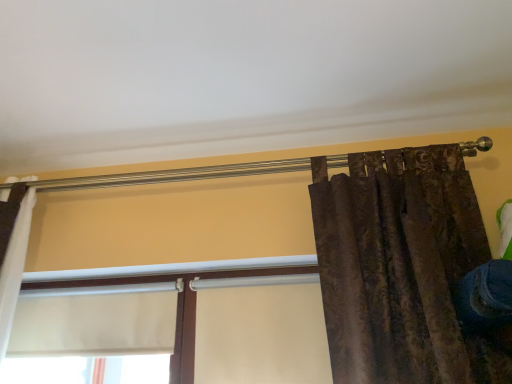
Question: Considering the relative sizes of white matte window at center, arranged as the first window when viewed from the left, and blue denim jeans at lower right in the image provided, is white matte window at center, arranged as the first window when viewed from the left, wider than blue denim jeans at lower right?

Choices:
 (A) no
 (B) yes

Answer: (A)

Question: Is white matte window at center, the 2th window positioned from the right, at the left side of blue denim jeans at lower right?

Choices:
 (A) no
 (B) yes

Answer: (B)

Question: Is white matte window at center, arranged as the first window when viewed from the left, further to the viewer compared to blue denim jeans at lower right?

Choices:
 (A) yes
 (B) no

Answer: (A)

Question: From the image's perspective, is white matte window at center, arranged as the first window when viewed from the left, over blue denim jeans at lower right?

Choices:
 (A) yes
 (B) no

Answer: (B)

Question: Is white matte window at center, arranged as the first window when viewed from the left, taller than blue denim jeans at lower right?

Choices:
 (A) yes
 (B) no

Answer: (A)

Question: Looking at their shapes, would you say white matte window at center, acting as the first window starting from the right, is wider or thinner than white matte window at center, arranged as the first window when viewed from the left?

Choices:
 (A) wide
 (B) thin

Answer: (A)

Question: Is white matte window at center, acting as the first window starting from the right, bigger or smaller than white matte window at center, the 2th window positioned from the right?

Choices:
 (A) big
 (B) small

Answer: (A)

Question: Is point (42, 327) positioned closer to the camera than point (6, 367)?

Choices:
 (A) farther
 (B) closer

Answer: (A)

Question: Considering their positions, is white matte window at center, acting as the first window starting from the right, located in front of or behind white matte window at center, arranged as the first window when viewed from the left?

Choices:
 (A) front
 (B) behind

Answer: (A)

Question: Considering the positions of point (485, 324) and point (150, 291), is point (485, 324) closer or farther from the camera than point (150, 291)?

Choices:
 (A) closer
 (B) farther

Answer: (A)

Question: Would you say blue denim jeans at lower right is to the left or to the right of white matte window at center, arranged as the first window when viewed from the left, in the picture?

Choices:
 (A) right
 (B) left

Answer: (A)

Question: From a real-world perspective, relative to white matte window at center, the 2th window positioned from the right, is blue denim jeans at lower right vertically above or below?

Choices:
 (A) above
 (B) below

Answer: (B)

Question: In terms of size, does blue denim jeans at lower right appear bigger or smaller than white matte window at center, the 2th window positioned from the right?

Choices:
 (A) small
 (B) big

Answer: (A)

Question: Would you say white matte window at center, the 2th window positioned from the right, is inside or outside blue denim jeans at lower right?

Choices:
 (A) inside
 (B) outside

Answer: (B)

Question: From the image's perspective, is white matte window at center, arranged as the first window when viewed from the left, positioned above or below blue denim jeans at lower right?

Choices:
 (A) below
 (B) above

Answer: (A)